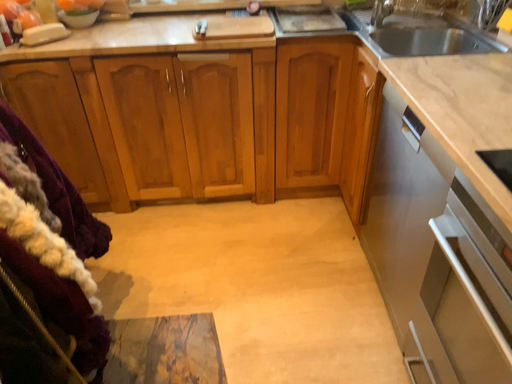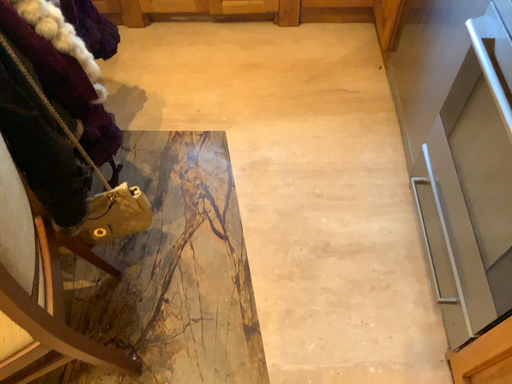
Question: Which way did the camera rotate in the video?

Choices:
 (A) rotated downward
 (B) rotated upward

Answer: (A)